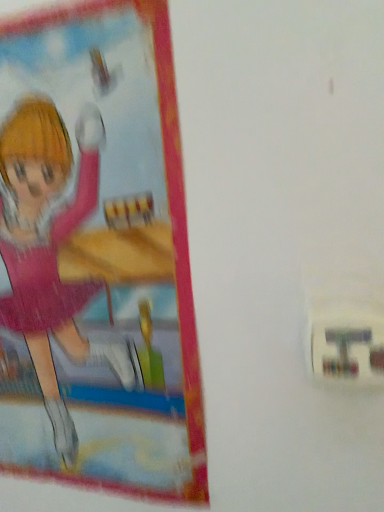
The image size is (384, 512). Identify the location of pink matte poster at left. (96, 255).

Image resolution: width=384 pixels, height=512 pixels. Describe the element at coordinates (96, 255) in the screenshot. I see `pink matte poster at left` at that location.

This screenshot has height=512, width=384. Identify the location of pink matte poster at left. (96, 255).